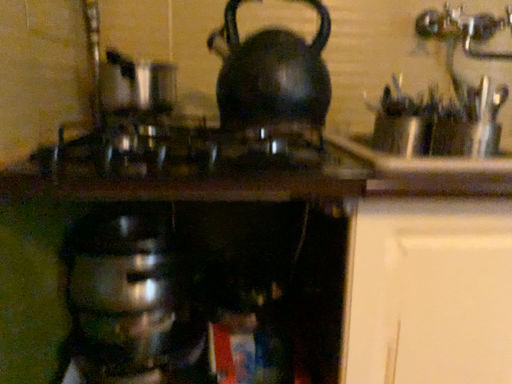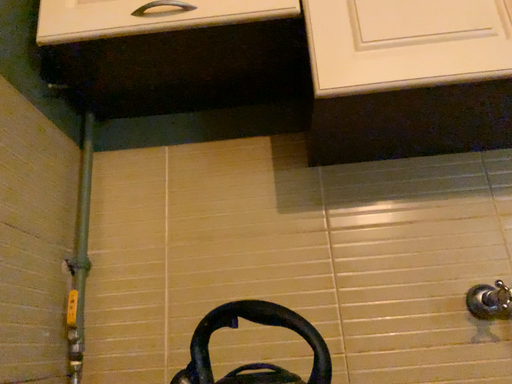
Question: Which way did the camera rotate in the video?

Choices:
 (A) rotated upward
 (B) rotated downward

Answer: (A)